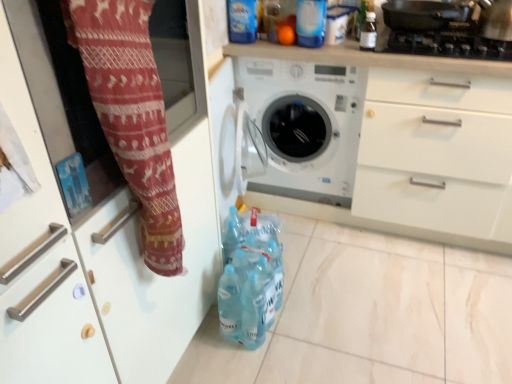
Question: From a real-world perspective, does red knit fabric at left stand above white plastic washing machine at center?

Choices:
 (A) no
 (B) yes

Answer: (B)

Question: Can you confirm if red knit fabric at left is thinner than white plastic washing machine at center?

Choices:
 (A) yes
 (B) no

Answer: (A)

Question: Is red knit fabric at left turned away from white plastic washing machine at center?

Choices:
 (A) yes
 (B) no

Answer: (B)

Question: Is red knit fabric at left taller than white plastic washing machine at center?

Choices:
 (A) yes
 (B) no

Answer: (B)

Question: Is the depth of red knit fabric at left less than that of white plastic washing machine at center?

Choices:
 (A) yes
 (B) no

Answer: (A)

Question: Which is correct: translucent plastic bottles at lower center, arranged as the 2th bottle when viewed from the right, is inside black matte gas stove at upper right, or outside of it?

Choices:
 (A) inside
 (B) outside

Answer: (B)

Question: Considering their positions, is translucent plastic bottles at lower center, arranged as the 2th bottle when viewed from the right, located in front of or behind black matte gas stove at upper right?

Choices:
 (A) behind
 (B) front

Answer: (B)

Question: Based on their positions, is translucent plastic bottles at lower center, the first bottle viewed from the left, located to the left or right of black matte gas stove at upper right?

Choices:
 (A) left
 (B) right

Answer: (A)

Question: From a real-world perspective, is translucent plastic bottles at lower center, the second bottle from the top, positioned above or below black matte gas stove at upper right?

Choices:
 (A) above
 (B) below

Answer: (B)

Question: From the image's perspective, relative to red knit fabric at left, is white plastic washing machine at center above or below?

Choices:
 (A) below
 (B) above

Answer: (B)

Question: In terms of size, does white plastic washing machine at center appear bigger or smaller than red knit fabric at left?

Choices:
 (A) big
 (B) small

Answer: (A)

Question: In the image, is white plastic washing machine at center positioned in front of or behind red knit fabric at left?

Choices:
 (A) behind
 (B) front

Answer: (A)

Question: Is white plastic washing machine at center wider or thinner than red knit fabric at left?

Choices:
 (A) thin
 (B) wide

Answer: (B)

Question: Considering the positions of white plastic washing machine at center and transparent plastic bottle at upper right, the 2th bottle ordered from the bottom, in the image, is white plastic washing machine at center taller or shorter than transparent plastic bottle at upper right, the 2th bottle ordered from the bottom,?

Choices:
 (A) tall
 (B) short

Answer: (A)

Question: Is white plastic washing machine at center to the left or to the right of transparent plastic bottle at upper right, placed as the first bottle when sorted from right to left, in the image?

Choices:
 (A) left
 (B) right

Answer: (A)